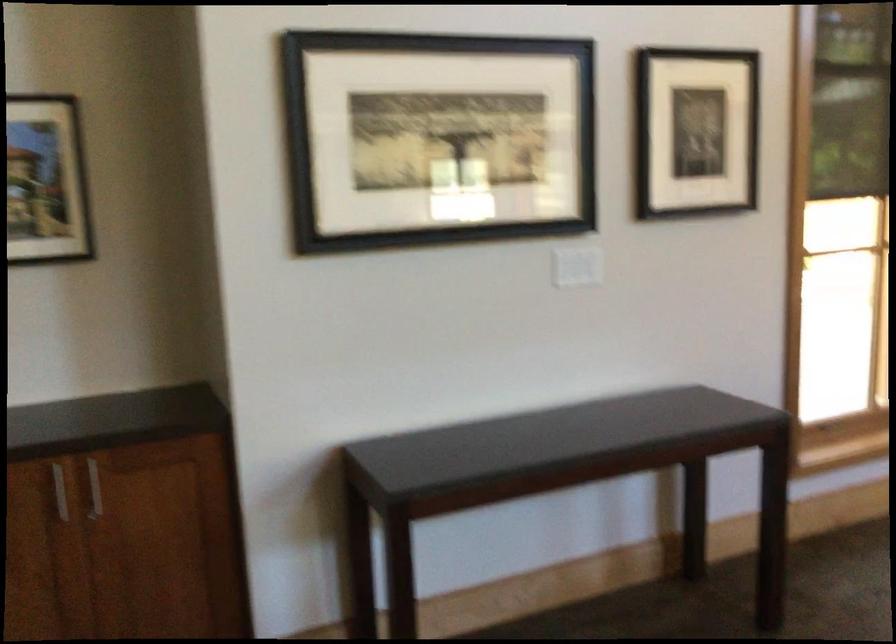
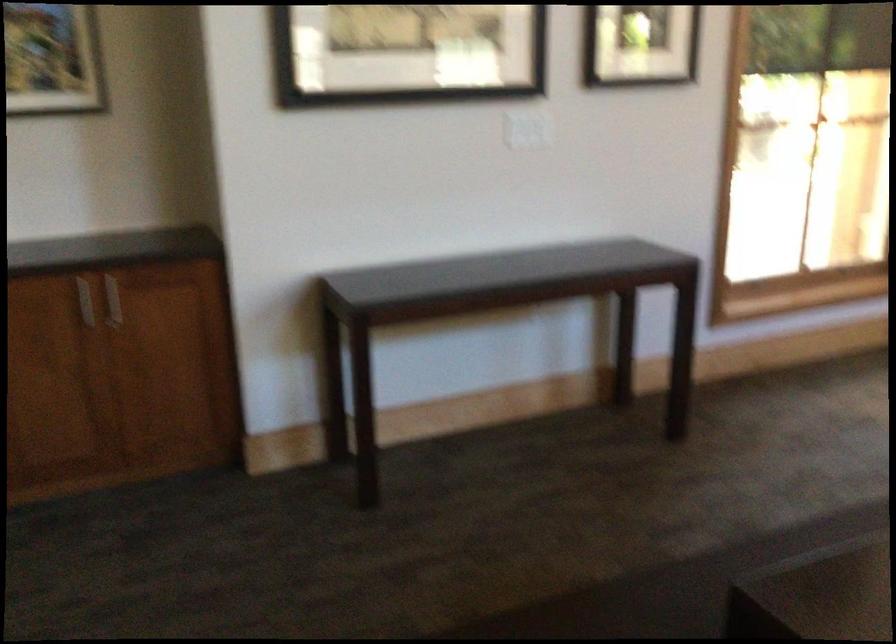
Question: Which direction would the cameraman need to move to produce the second image? Reply with the corresponding letter.

Choices:
 (A) Left
 (B) Right
 (C) Forward
 (D) Backward

Answer: (D)